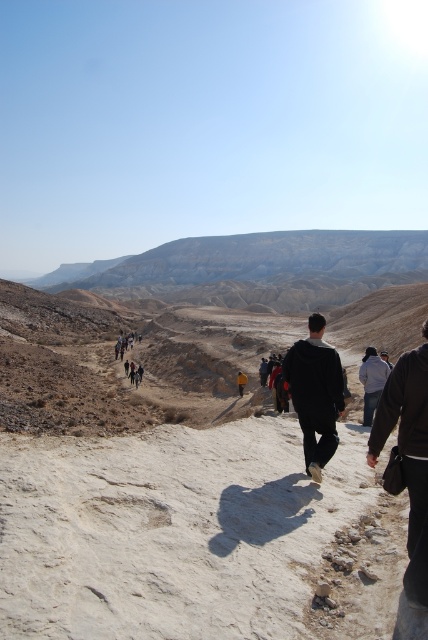
You are a hiker trying to navigate through the rugged terrain. You see two points marked on your map corresponding to coordinates in the image. The first point is at point (x=279, y=561) and the second is at point (x=178, y=300). Which point is closer to your current position?

Point (x=279, y=561) is closer to the viewer than point (x=178, y=300), so the first point is closer to your current position.

You are a hiker trying to follow the path in the arid landscape. You see two points marked on the terrain. The first point is at coordinate point (x=318, y=552) and the second is at point (x=312, y=406). Which point should you step on first if you want to move forward along the path?

You should step on point (x=318, y=552) first because it is in front of point (x=312, y=406) along the path.

You are a hiker trying to navigate to the desert sandstone mountain at upper center. You have a map that shows the mountain at coordinates point 0.422, 0.600. If your current position is at point 0.300, 0.700, in which direction should you move to reach the mountain?

The desert sandstone mountain at upper center is located at point (256, 269). Your current position is at point (299, 192). To reach the mountain, you should move northeast because the mountain is northeast of your current location.